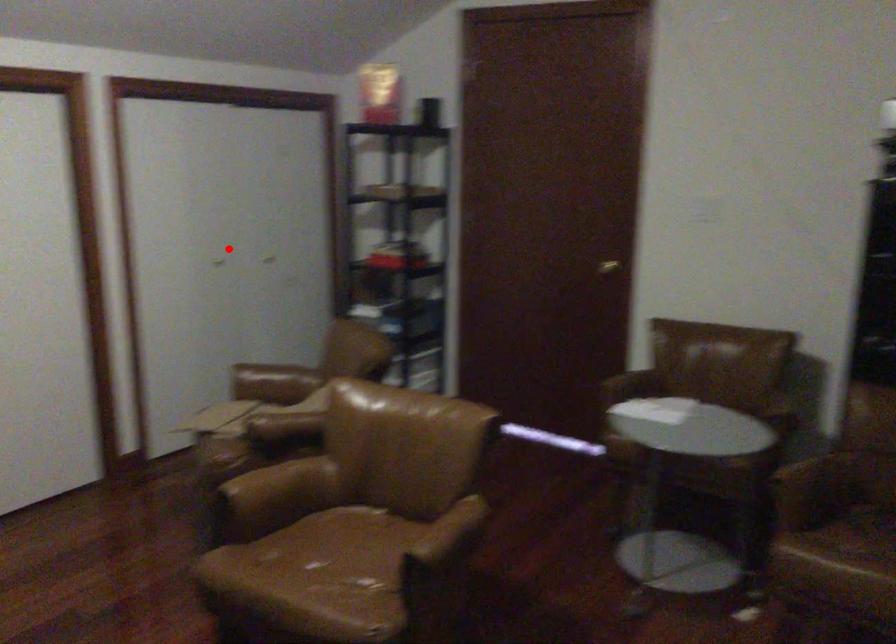
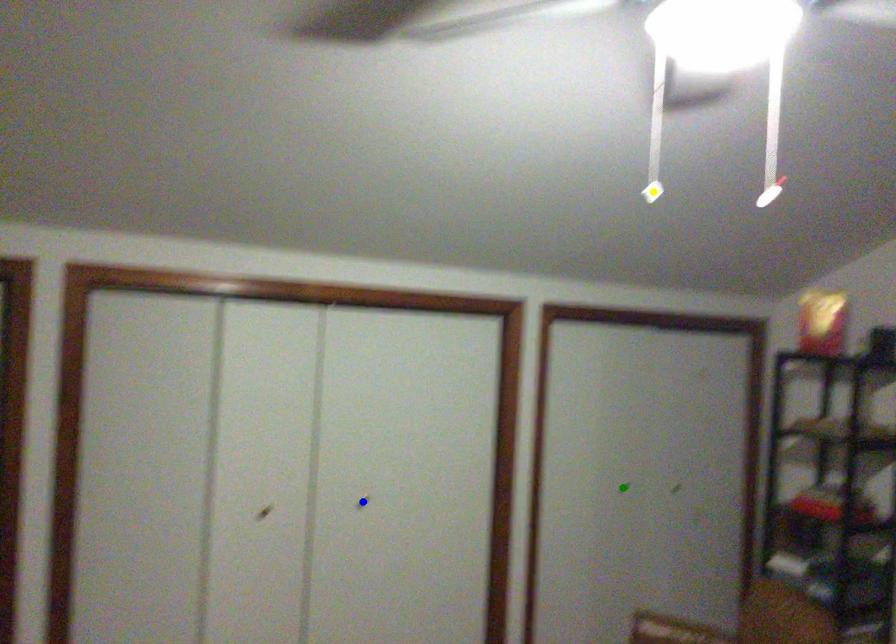
Question: I am providing you with two images of the same scene from different viewpoints. A red point is marked on the first image. You are given multiple points on the second image. Which spot in image 2 lines up with the point in image 1?

Choices:
 (A) yellow point
 (B) green point
 (C) blue point

Answer: (B)